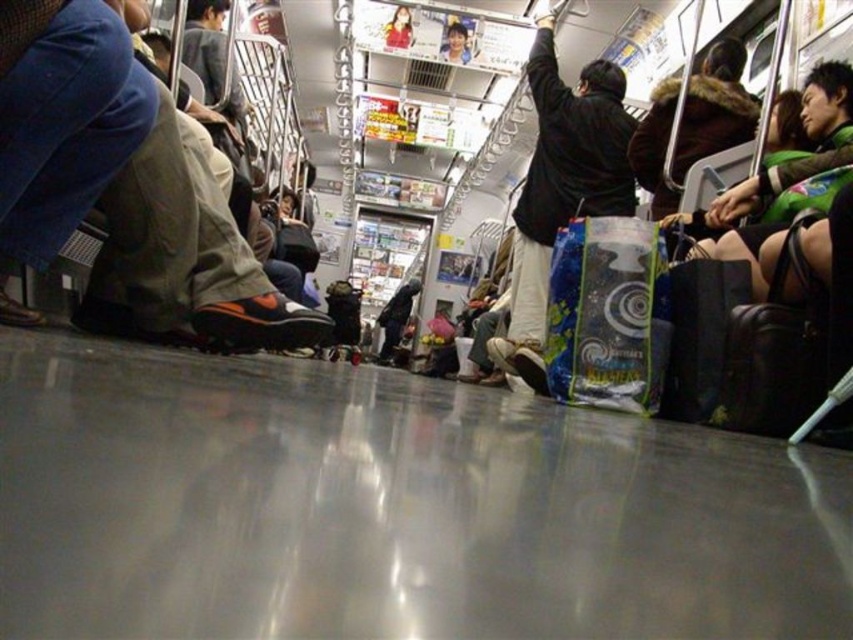
Question: Is orange suede shoe at lower left to the left of black matte jacket at upper center from the viewer's perspective?

Choices:
 (A) yes
 (B) no

Answer: (A)

Question: Which object appears farthest from the camera in this image?

Choices:
 (A) black matte jacket at upper center
 (B) orange suede shoe at lower left

Answer: (A)

Question: Can you confirm if orange suede shoe at lower left is wider than black matte jacket at upper center?

Choices:
 (A) no
 (B) yes

Answer: (A)

Question: Can you confirm if orange suede shoe at lower left is positioned above black matte jacket at upper center?

Choices:
 (A) no
 (B) yes

Answer: (A)